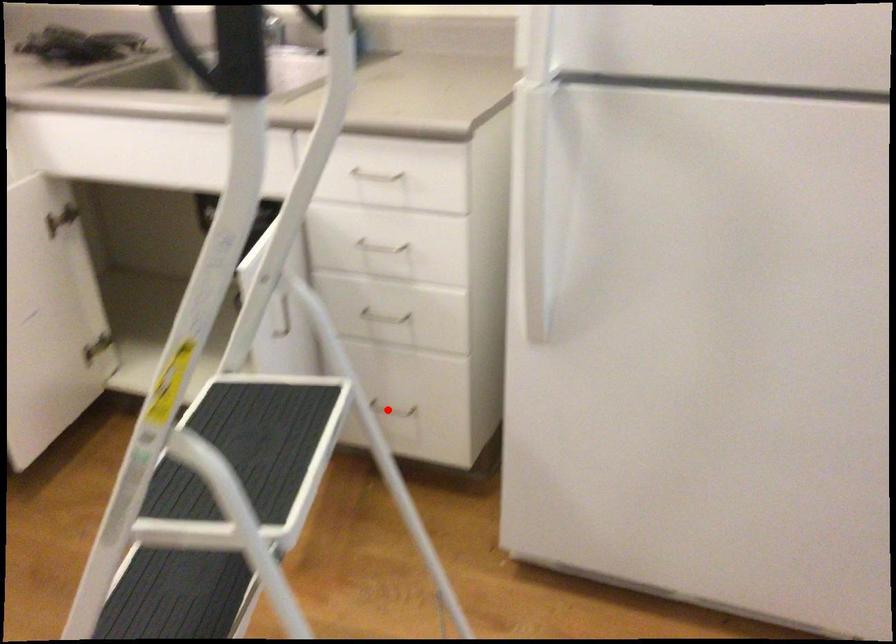
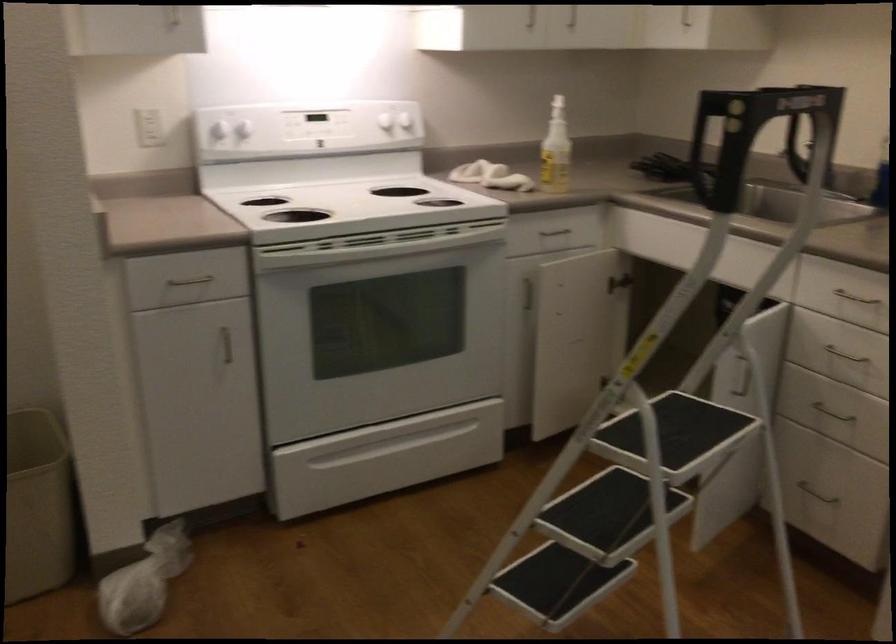
Locate, in the second image, the point that corresponds to the highlighted location in the first image.

(815, 493)